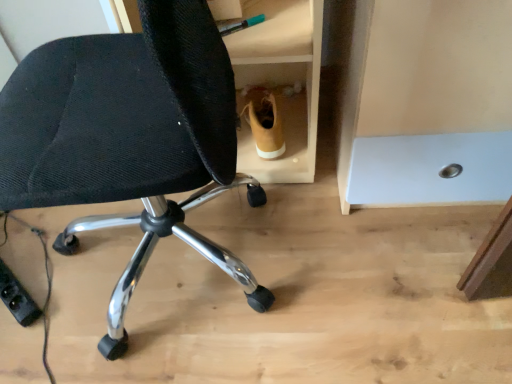
Question: Should I look upward or downward to see light brown leather boot at center?

Choices:
 (A) down
 (B) up

Answer: (B)

Question: From a real-world perspective, is black mesh chair at lower left below light brown leather boot at center?

Choices:
 (A) no
 (B) yes

Answer: (A)

Question: Is black mesh chair at lower left to the right of light brown leather boot at center from the viewer's perspective?

Choices:
 (A) no
 (B) yes

Answer: (A)

Question: Is black mesh chair at lower left turned away from light brown leather boot at center?

Choices:
 (A) no
 (B) yes

Answer: (A)

Question: Is black mesh chair at lower left positioned in front of light brown leather boot at center?

Choices:
 (A) yes
 (B) no

Answer: (A)

Question: From the image's perspective, is black mesh chair at lower left over light brown leather boot at center?

Choices:
 (A) no
 (B) yes

Answer: (A)

Question: Does black mesh chair at lower left have a greater height compared to light brown leather boot at center?

Choices:
 (A) yes
 (B) no

Answer: (A)

Question: Is light brown leather boot at center far from black mesh chair at lower left?

Choices:
 (A) no
 (B) yes

Answer: (A)

Question: From the image's perspective, is light brown leather boot at center located above black mesh chair at lower left?

Choices:
 (A) no
 (B) yes

Answer: (B)

Question: Can we say light brown leather boot at center lies outside black mesh chair at lower left?

Choices:
 (A) no
 (B) yes

Answer: (B)

Question: Is light brown leather boot at center at the left side of black mesh chair at lower left?

Choices:
 (A) no
 (B) yes

Answer: (A)

Question: Considering the relative sizes of light brown leather boot at center and black mesh chair at lower left in the image provided, is light brown leather boot at center smaller than black mesh chair at lower left?

Choices:
 (A) no
 (B) yes

Answer: (B)

Question: Does light brown leather boot at center appear on the right side of black mesh chair at lower left?

Choices:
 (A) yes
 (B) no

Answer: (A)

Question: From a real-world perspective, relative to light brown leather boot at center, is black mesh chair at lower left vertically above or below?

Choices:
 (A) above
 (B) below

Answer: (A)